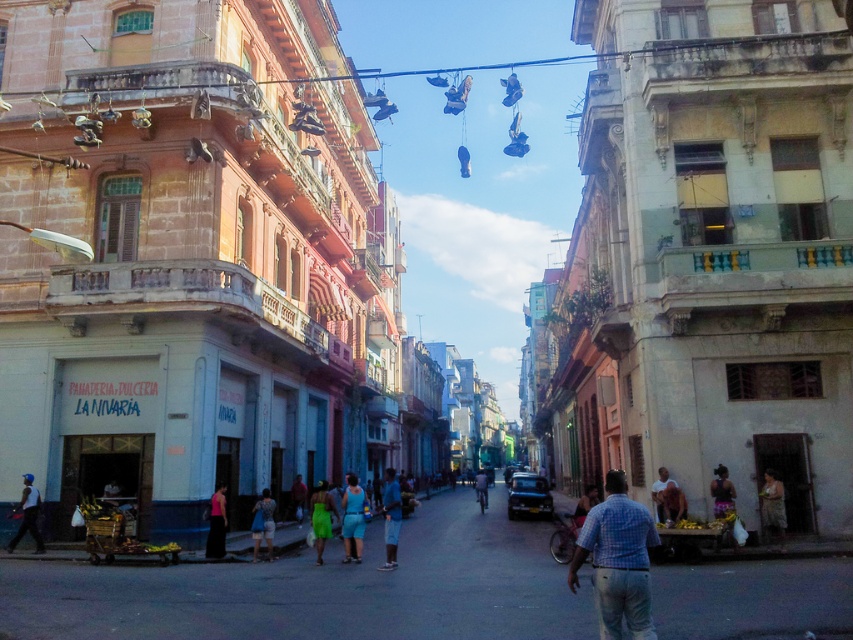
Question: Which is nearer to the brown fabric dress at lower right?

Choices:
 (A) green fabric dress at center
 (B) green fabric dress at lower center
 (C) pink fabric skirt at lower center

Answer: (A)

Question: Can you confirm if blue fabric dress at center is positioned above blue fabric shorts at center?

Choices:
 (A) no
 (B) yes

Answer: (B)

Question: Can you confirm if green fabric dress at center is thinner than green fabric dress at lower center?

Choices:
 (A) yes
 (B) no

Answer: (B)

Question: Can you confirm if metallic wire at upper center is positioned below brown fabric dress at lower right?

Choices:
 (A) yes
 (B) no

Answer: (B)

Question: Estimate the real-world distances between objects in this image. Which object is closer to the blue denim shorts at center?

Choices:
 (A) light blue fabric shirt at center
 (B) green fabric dress at lower center

Answer: (B)

Question: Which is nearer to the checkered shirt at center?

Choices:
 (A) light blue fabric shirt at center
 (B) white matte baseball cap at lower left
 (C) green fabric dress at lower center

Answer: (C)